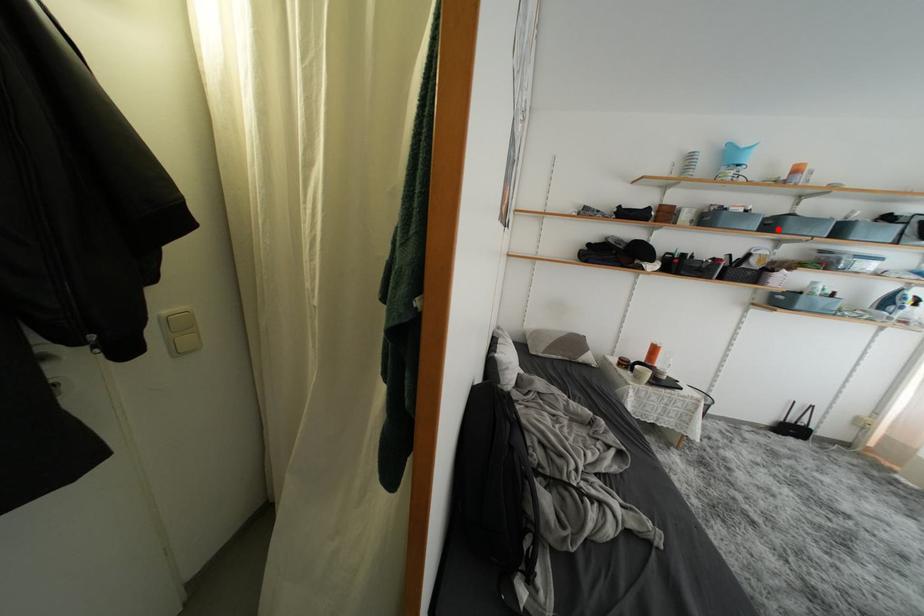
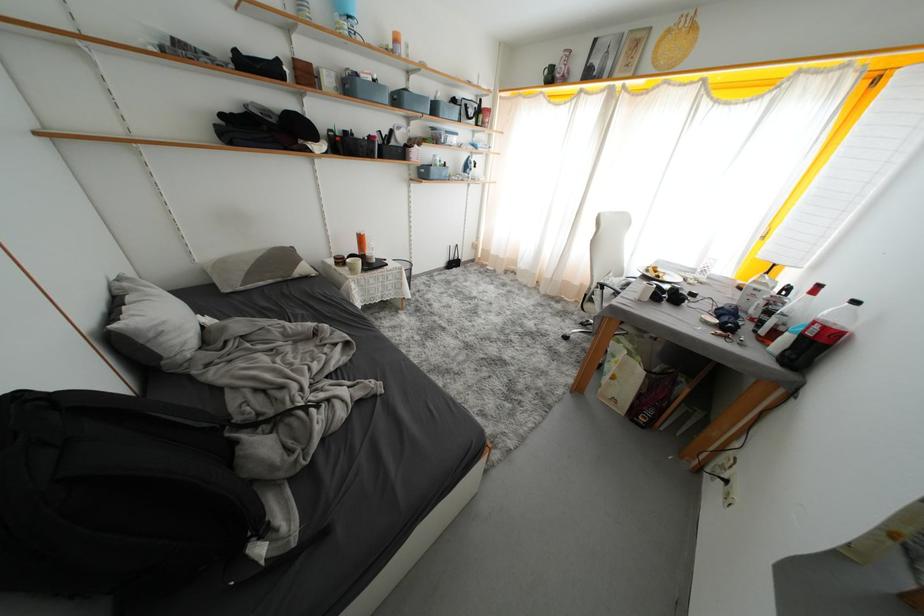
Question: I am providing you with two images of the same scene from different viewpoints. In image1, a red point is highlighted. Considering the same 3D point in image2, which of the following is correct?

Choices:
 (A) It is closer
 (B) It is farther

Answer: (A)